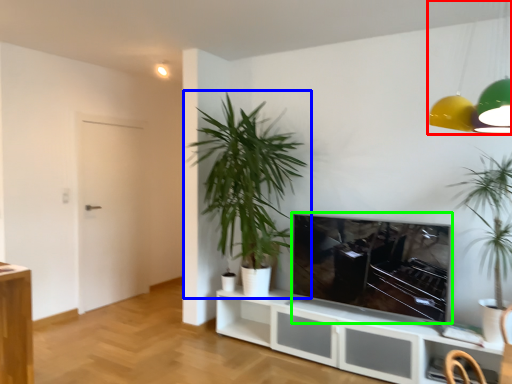
Question: Which is farther away from lamp (highlighted by a red box)? houseplant (highlighted by a blue box) or television (highlighted by a green box)?

Choices:
 (A) houseplant
 (B) television

Answer: (A)